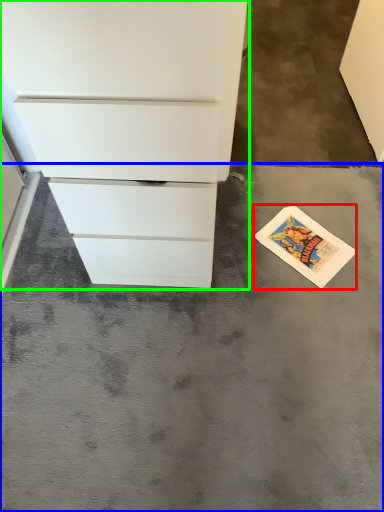
Question: Which is nearer to the postcard (highlighted by a red box)? concrete (highlighted by a blue box) or chest of drawers (highlighted by a green box).

Choices:
 (A) concrete
 (B) chest of drawers

Answer: (A)